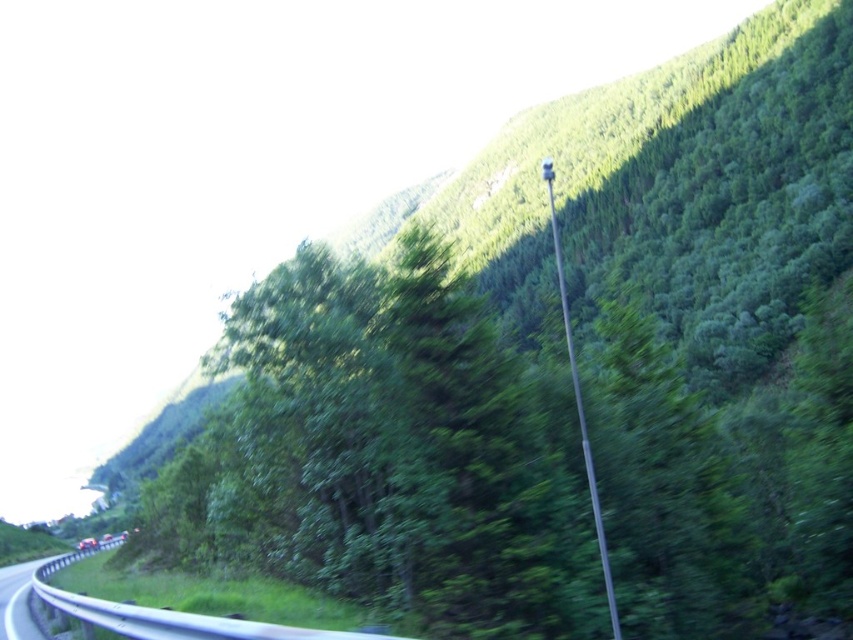
You are a photographer planning to capture a landscape shot that emphasizes both the green leafy hillside at upper center and the metallic gray highway at lower left. Based on the scene, which object occupies more horizontal space in the image?

The green leafy hillside at upper center might be wider than the metallic gray highway at lower left, so it likely occupies more horizontal space in the image.